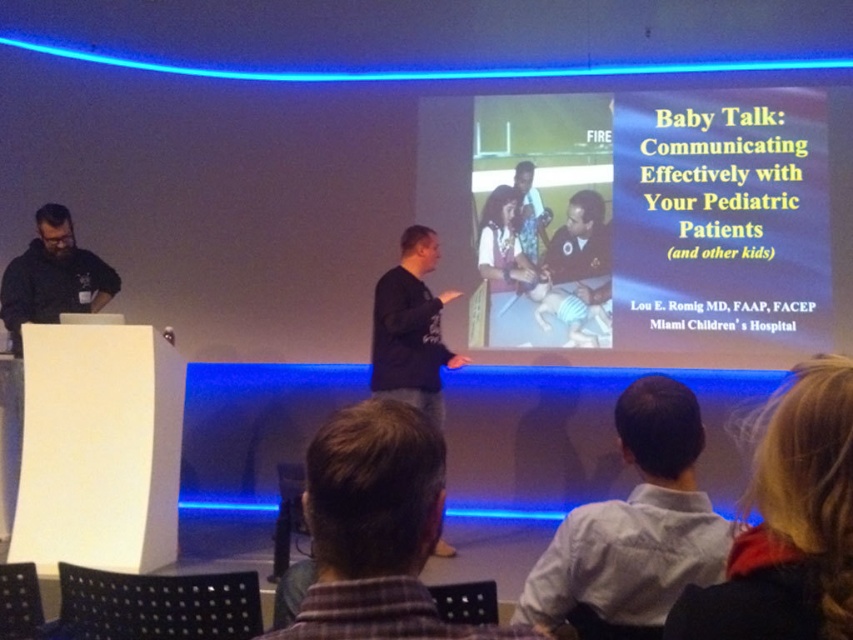
Which is below, brown plaid shirt at lower center or black matte shirt at center?

brown plaid shirt at lower center

Does brown plaid shirt at lower center appear on the right side of black matte shirt at center?

Correct, you'll find brown plaid shirt at lower center to the right of black matte shirt at center.

I want to click on brown plaid shirt at lower center, so click(376, 529).

Can you confirm if white matte projector screen at center is shorter than black matte shirt at center?

Incorrect, white matte projector screen at center's height does not fall short of black matte shirt at center's.

Is point (820, 148) farther from camera compared to point (428, 252)?

Yes, point (820, 148) is behind point (428, 252).

Where is `white matte projector screen at center`? This screenshot has width=853, height=640. white matte projector screen at center is located at coordinates (666, 208).

Which is behind, point (428, 348) or point (4, 298)?

The point (4, 298) is more distant.

Is black matte shirt at center shorter than dark brown beard at left?

Incorrect, black matte shirt at center's height does not fall short of dark brown beard at left's.

This screenshot has height=640, width=853. What do you see at coordinates (410, 328) in the screenshot? I see `black matte shirt at center` at bounding box center [410, 328].

Identify the location of black matte shirt at center. (410, 328).